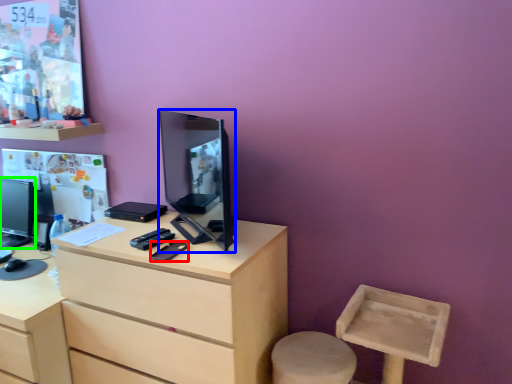
Question: Based on their relative distances, which object is nearer to mobile phone (highlighted by a red box)? Choose from television (highlighted by a blue box) and television (highlighted by a green box).

Choices:
 (A) television
 (B) television

Answer: (A)